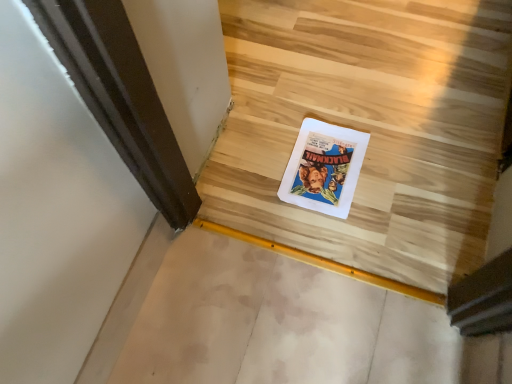
In order to face matte white book cover at center, should I rotate leftwards or rightwards?

You should rotate right by 8.826 degrees.

At what (x,y) coordinates should I click in order to perform the action: click on matte white book cover at center. Please return your answer as a coordinate pair (x, y). Looking at the image, I should click on (324, 168).

This screenshot has height=384, width=512. Describe the element at coordinates (324, 168) in the screenshot. I see `matte white book cover at center` at that location.

I want to click on matte white book cover at center, so click(324, 168).